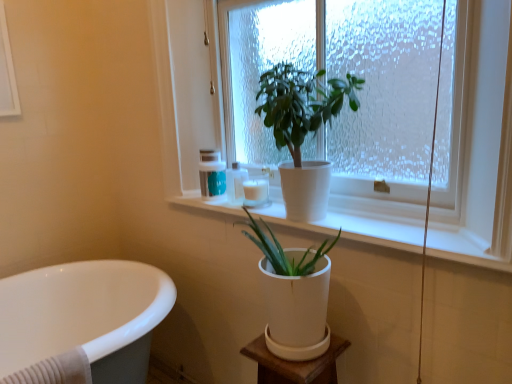
Question: Can you confirm if white glossy bathtub at lower left is wider than green matte plant at upper center, the second houseplant positioned from the bottom?

Choices:
 (A) no
 (B) yes

Answer: (B)

Question: Is white glossy bathtub at lower left thinner than green matte plant at upper center, the second houseplant positioned from the bottom?

Choices:
 (A) yes
 (B) no

Answer: (B)

Question: From a real-world perspective, is white glossy bathtub at lower left on top of green matte plant at upper center, acting as the 1th houseplant starting from the top?

Choices:
 (A) yes
 (B) no

Answer: (B)

Question: Could you tell me if white glossy bathtub at lower left is turned towards green matte plant at upper center, the second houseplant positioned from the bottom?

Choices:
 (A) no
 (B) yes

Answer: (A)

Question: Is white glossy bathtub at lower left at the right side of green matte plant at upper center, the second houseplant positioned from the bottom?

Choices:
 (A) no
 (B) yes

Answer: (A)

Question: Is matte white bottle at upper center, placed as the 2th toiletry when sorted from left to right, to the left or to the right of white matte plant pot at upper center in the image?

Choices:
 (A) left
 (B) right

Answer: (A)

Question: Is matte white bottle at upper center, placed as the 2th toiletry when sorted from left to right, bigger or smaller than white matte plant pot at upper center?

Choices:
 (A) big
 (B) small

Answer: (B)

Question: From the image's perspective, relative to white matte plant pot at upper center, is matte white bottle at upper center, placed as the 2th toiletry when sorted from left to right, above or below?

Choices:
 (A) above
 (B) below

Answer: (B)

Question: Considering the positions of matte white bottle at upper center, the 2th toiletry positioned from the right, and white matte plant pot at upper center in the image, is matte white bottle at upper center, the 2th toiletry positioned from the right, wider or thinner than white matte plant pot at upper center?

Choices:
 (A) wide
 (B) thin

Answer: (B)

Question: In terms of height, does white glossy bathtub at lower left look taller or shorter compared to white matte window sill at upper center?

Choices:
 (A) tall
 (B) short

Answer: (A)

Question: Looking at their shapes, would you say white glossy bathtub at lower left is wider or thinner than white matte window sill at upper center?

Choices:
 (A) thin
 (B) wide

Answer: (B)

Question: Considering their positions, is white glossy bathtub at lower left located in front of or behind white matte window sill at upper center?

Choices:
 (A) front
 (B) behind

Answer: (B)

Question: Does point (1, 349) appear closer or farther from the camera than point (324, 223)?

Choices:
 (A) farther
 (B) closer

Answer: (A)

Question: Visually, is white matte pot at center, the first houseplant when ordered from bottom to top, positioned to the left or to the right of matte white container at upper center, which is the 1th toiletry in left-to-right order?

Choices:
 (A) right
 (B) left

Answer: (A)

Question: Does point (270, 251) appear closer or farther from the camera than point (202, 178)?

Choices:
 (A) closer
 (B) farther

Answer: (A)